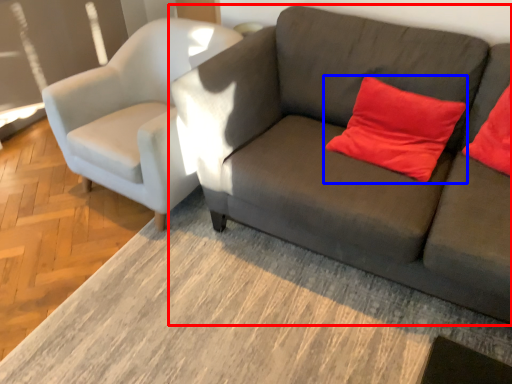
Question: Which object appears farthest to the camera in this image, studio couch (highlighted by a red box) or pillow (highlighted by a blue box)?

Choices:
 (A) studio couch
 (B) pillow

Answer: (B)